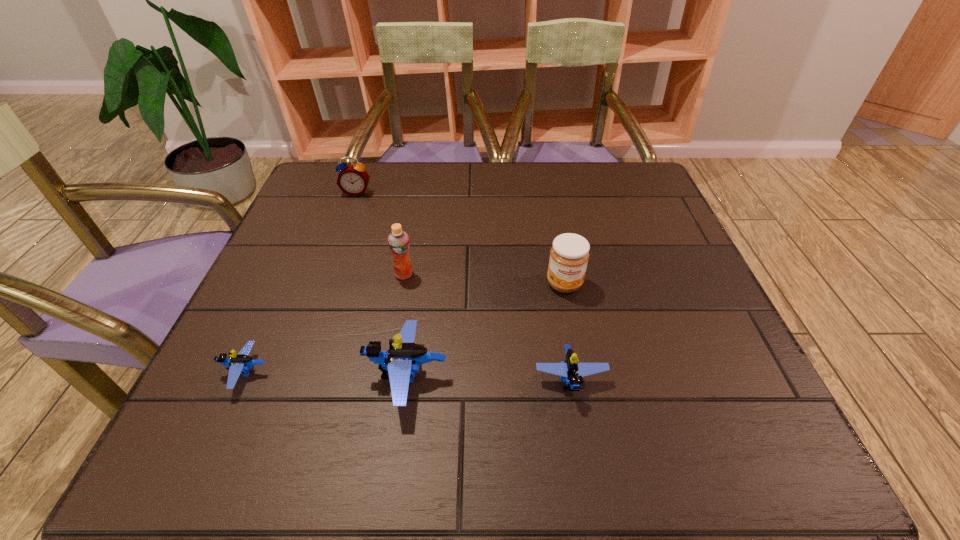
Locate an element on the screen. vacant region at the far edge is located at coordinates point(444,173).

I want to click on free space at the near edge, so click(300, 390).

Find the location of a particular element. vacant space at the left edge of the desktop is located at coordinates (287, 289).

You are a GUI agent. You are given a task and a screenshot of the screen. Output one action in this format:
    pyautogui.click(x=<x>, y=<y>)
    Task: Click on the free space at the right edge
    
    Given the screenshot: What is the action you would take?
    [x=665, y=346]

Where is `free space at the near left corner of the desktop`? free space at the near left corner of the desktop is located at coordinates (262, 402).

Where is `free region at the near right corner of the desktop`? This screenshot has width=960, height=540. free region at the near right corner of the desktop is located at coordinates (704, 403).

Identify the location of empty location between the jam and the tallest Lego. (486, 330).

Locate an element on the screen. vacant area between the fifth object from right to left and the tallest Lego is located at coordinates tap(382, 284).

Where is `free space between the tallest Lego and the second shortest object`? free space between the tallest Lego and the second shortest object is located at coordinates (489, 378).

I want to click on vacant area between the alarm clock and the shortest object, so click(301, 282).